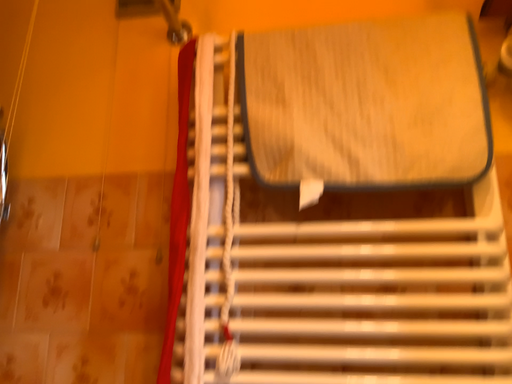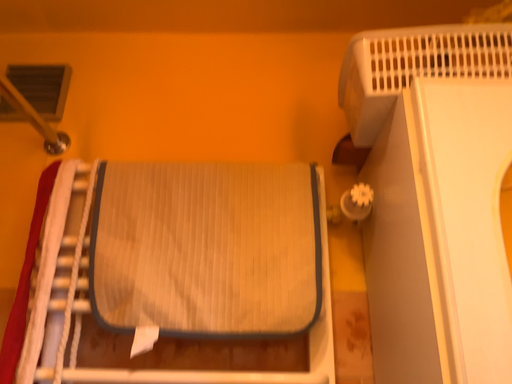
Question: How did the camera likely rotate when shooting the video?

Choices:
 (A) rotated right
 (B) rotated left

Answer: (A)